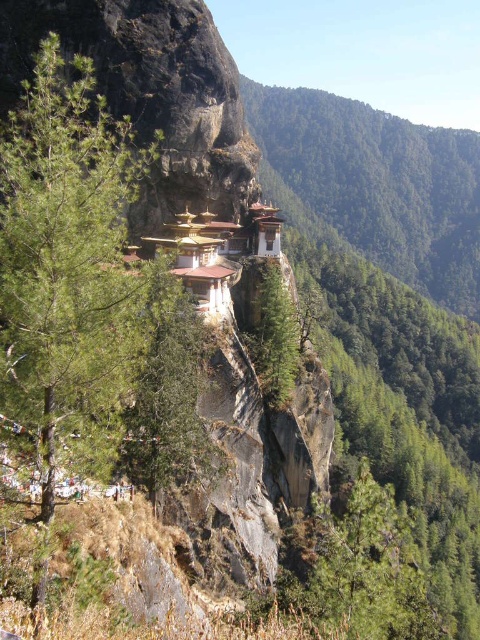
You are standing at the edge of the cliff where the temple is built. You notice a point marked at coordinates (380, 182). What object is located at this point?

The point at (380, 182) has a green leafy tree at center.

You are standing at the edge of the cliff looking at the two green trees at the center of the image. Which tree is closer to you, the green leafy tree at center or the green rough bark tree at center?

The green leafy tree at center is closer to you because it is further to the viewer than the green rough bark tree at center.